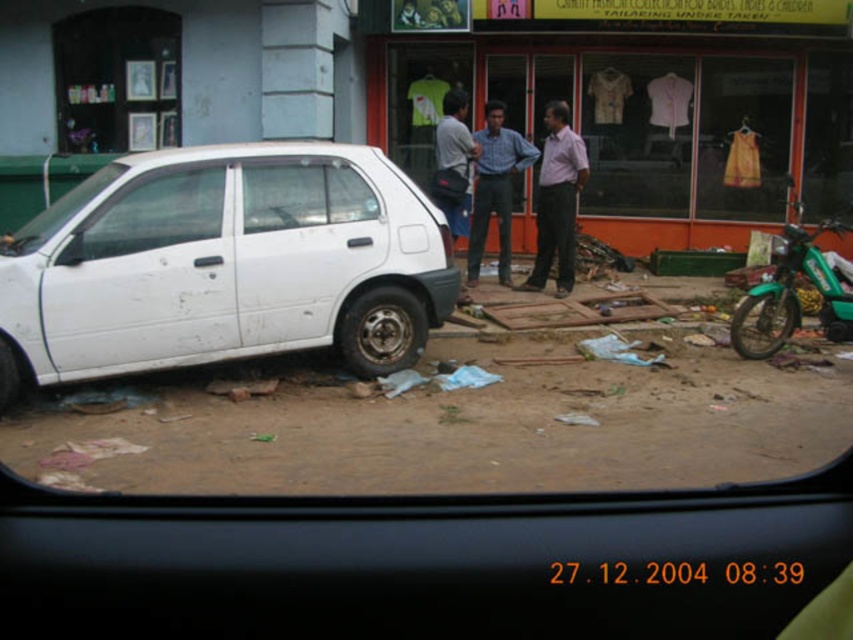
You are a driver who needs to decide which shirt to wear for a photoshoot. The pink smooth shirt at center and the light blue shirt at center are both visible in the scene. Based on their widths, which shirt would you choose if you want a wider option?

The pink smooth shirt at center might be wider than light blue shirt at center, so you should choose the pink smooth shirt at center for a wider option.

You are a passenger in a car and you see the white matte car at left and the transparent glass window at center. Which object is closer to the left side of the image?

The white matte car at left is closer to the left side of the image because it is positioned to the left of the transparent glass window at center.